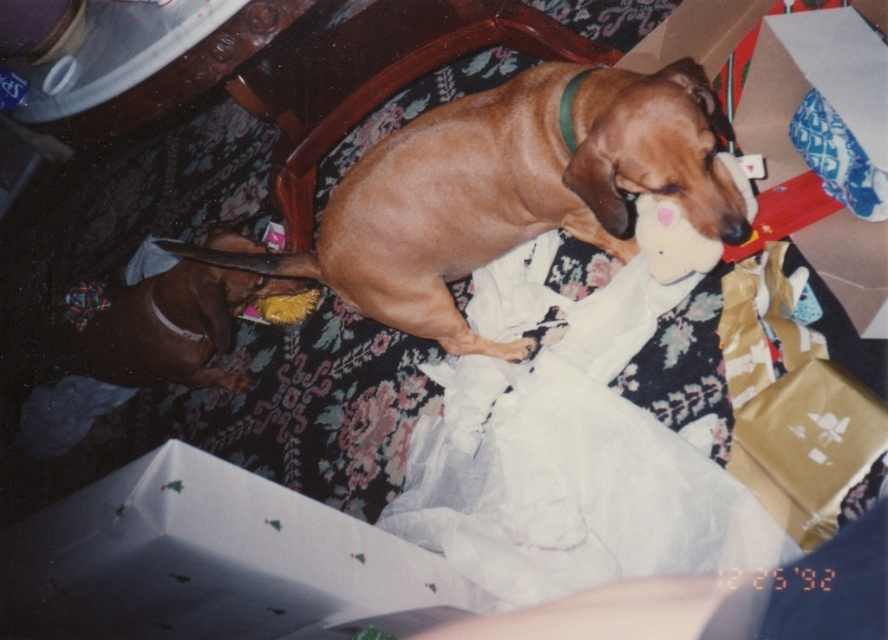
Describe the element at coordinates (509, 189) in the screenshot. This screenshot has width=888, height=640. I see `brown smooth dog at center` at that location.

Does point (462, 323) come farther from viewer compared to point (109, 321)?

No, (462, 323) is closer to viewer.

Where is `brown smooth dog at center`? brown smooth dog at center is located at coordinates click(x=509, y=189).

Which is in front, point (744, 84) or point (141, 346)?

Point (744, 84) is in front.

Does gold cardboard box at upper right have a greater height compared to brown matte dog at lower left?

Correct, gold cardboard box at upper right is much taller as brown matte dog at lower left.

Locate an element on the screen. This screenshot has height=640, width=888. gold cardboard box at upper right is located at coordinates (815, 81).

Between point (165, 280) and point (676, 262), which one is positioned in front?

Point (676, 262)

Does brown matte dog at lower left appear over white plush toy at upper center?

Incorrect, brown matte dog at lower left is not positioned above white plush toy at upper center.

Is point (167, 292) farther from camera compared to point (674, 260)?

That is True.

Find the location of a particular element. Image resolution: width=888 pixels, height=640 pixels. brown matte dog at lower left is located at coordinates (161, 324).